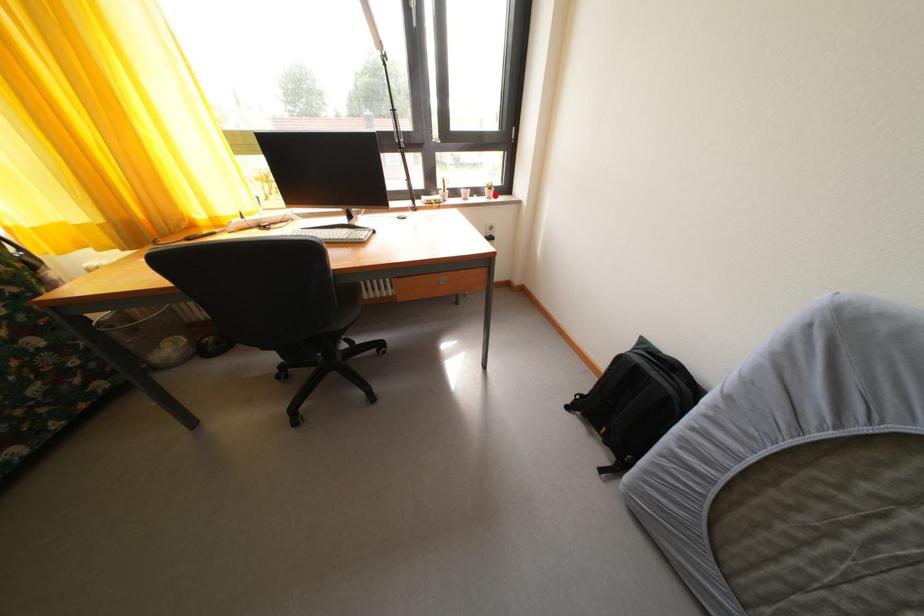
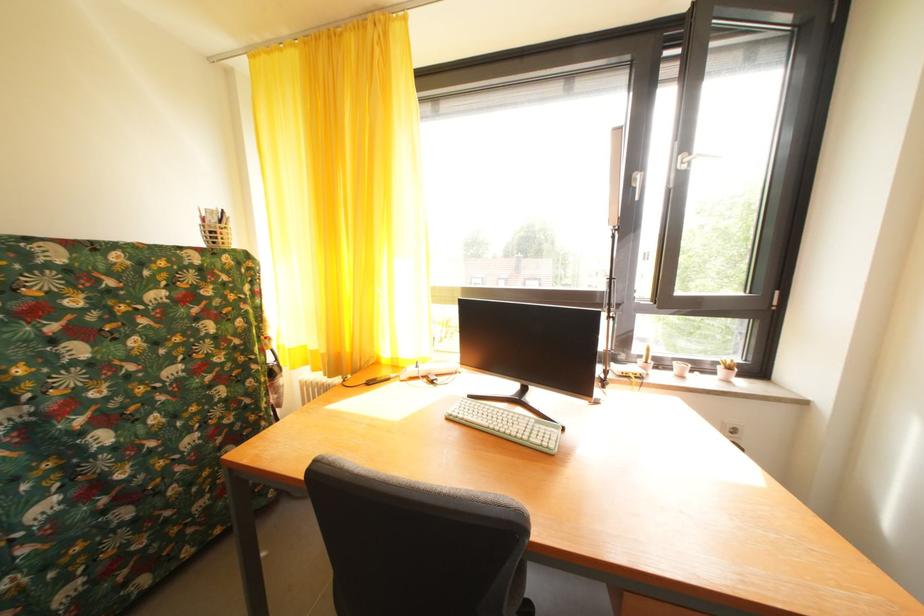
Question: I am providing you with two images of the same scene from different viewpoints. Image1 has a red point marked. In image2, the corresponding 3D location appears at what relative position? Reply with the corresponding letter.

Choices:
 (A) Closer
 (B) Farther

Answer: (B)